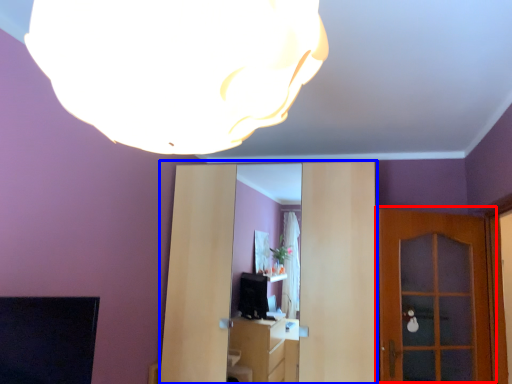
Question: Which of the following is the closest to the observer, door (highlighted by a red box) or entertainment center (highlighted by a blue box)?

Choices:
 (A) door
 (B) entertainment center

Answer: (B)